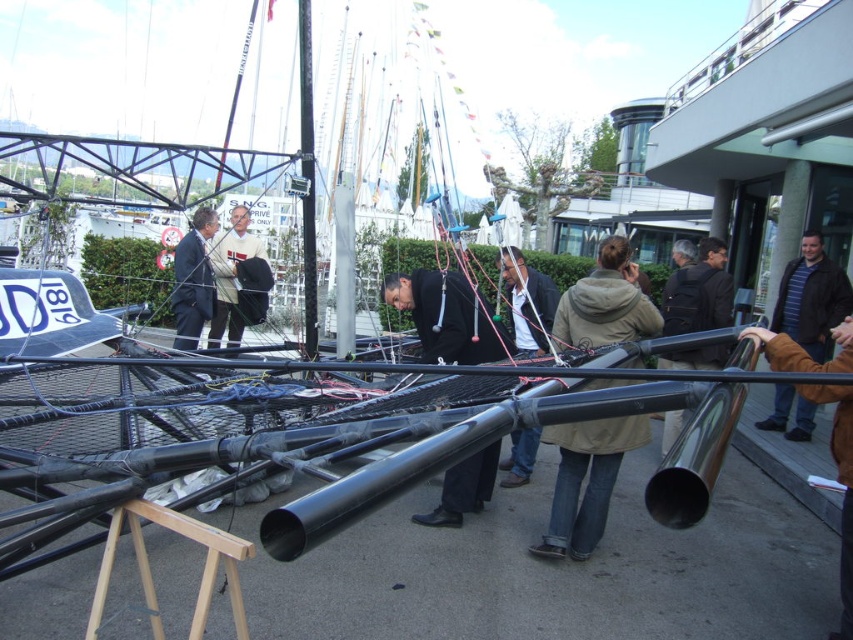
Question: Is the position of matte black jacket at center more distant than that of white knit sweater at center?

Choices:
 (A) no
 (B) yes

Answer: (A)

Question: Observing the image, what is the correct spatial positioning of striped sweater at right in reference to black matte pole at center?

Choices:
 (A) right
 (B) left

Answer: (A)

Question: Which point is farther from the camera taking this photo?

Choices:
 (A) (434, 342)
 (B) (683, 524)

Answer: (A)

Question: Considering the relative positions of matte black suit at center and white knit sweater at center in the image provided, where is matte black suit at center located with respect to white knit sweater at center?

Choices:
 (A) above
 (B) below

Answer: (B)

Question: Which object is farther from the camera taking this photo?

Choices:
 (A) khaki fabric jacket at center
 (B) matte black jacket at center

Answer: (B)

Question: Which point is farther to the camera?

Choices:
 (A) (730, 294)
 (B) (524, 340)
 (C) (799, 317)

Answer: (C)